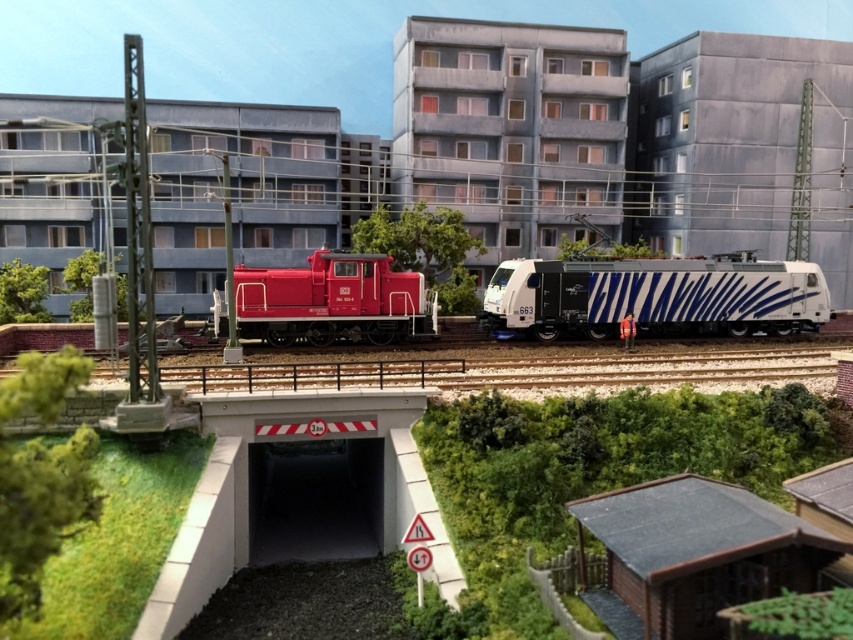
Between point (544, 339) and point (294, 269), which one is positioned behind?

The point (294, 269) is more distant.

Can you confirm if white glossy locomotive at center is positioned to the left of matte red locomotive at center?

No, white glossy locomotive at center is not to the left of matte red locomotive at center.

What do you see at coordinates (654, 294) in the screenshot? Image resolution: width=853 pixels, height=640 pixels. I see `white glossy locomotive at center` at bounding box center [654, 294].

I want to click on white glossy locomotive at center, so click(654, 294).